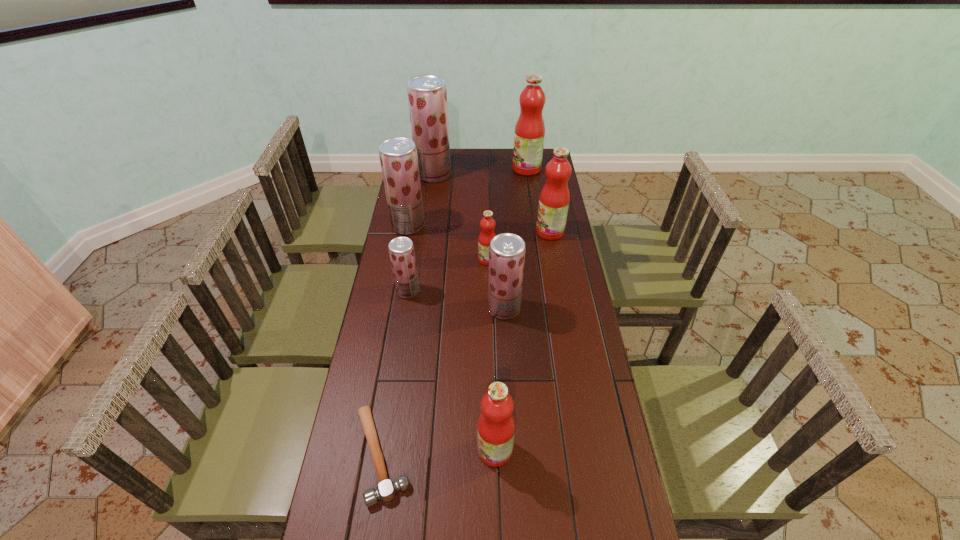
Find the location of a particular element. The width and height of the screenshot is (960, 540). hammer is located at coordinates (386, 490).

Where is `vacant space situated 0.150m on the front label of the biggest pink fruit juice`? The image size is (960, 540). vacant space situated 0.150m on the front label of the biggest pink fruit juice is located at coordinates (482, 168).

Image resolution: width=960 pixels, height=540 pixels. I want to click on free point located on the front label of the biggest pink fruit juice, so click(x=446, y=168).

The width and height of the screenshot is (960, 540). What are the coordinates of `free location located 0.110m on the front label of the biggest pink fruit juice` in the screenshot? It's located at (491, 168).

Identify the location of vacant space located on the front of the farthest strawberry fruit juice. The height and width of the screenshot is (540, 960). (427, 221).

Locate an element on the screen. The image size is (960, 540). free region located 0.360m on the front label of the third smallest pink fruit juice is located at coordinates (450, 232).

You are a GUI agent. You are given a task and a screenshot of the screen. Output one action in this format:
    pyautogui.click(x=<x>, y=<y>)
    Task: Click on the free spot located on the front label of the third smallest pink fruit juice
    Image resolution: width=960 pixels, height=540 pixels.
    Given the screenshot: What is the action you would take?
    pyautogui.click(x=507, y=232)

Find the location of a particular element. vacant point located on the front label of the third smallest pink fruit juice is located at coordinates (445, 232).

Find the location of a particular element. The width and height of the screenshot is (960, 540). vacant space located 0.190m on the right of the third nearest strawberry fruit juice is located at coordinates (469, 226).

I want to click on free spot located on the front of the third biggest strawberry fruit juice, so click(506, 342).